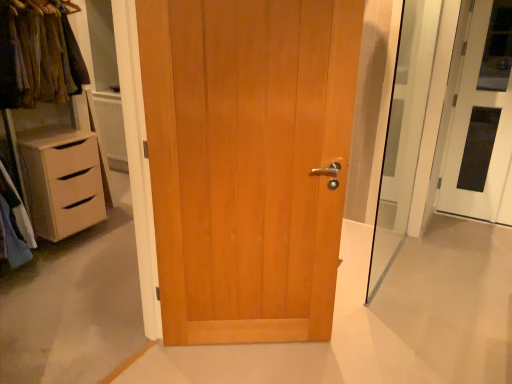
Identify the location of transparent glass screen door at right. (403, 134).

Where is `white glossy door at right, the 2th door positioned from the left`? white glossy door at right, the 2th door positioned from the left is located at coordinates (482, 122).

From the image's perspective, is white glossy door at right, the 2th door positioned from the left, on light brown wood door at center, the 2th door from the back?

Yes, from the image's perspective, white glossy door at right, the 2th door positioned from the left, is on top of light brown wood door at center, the 2th door from the back.

Is white glossy door at right, the 2th door positioned from the left, looking in the opposite direction of light brown wood door at center, the 2th door from the back?

No, white glossy door at right, the 2th door positioned from the left, is not facing away from light brown wood door at center, the 2th door from the back.

In the scene shown: From a real-world perspective, is white glossy door at right, the first door when ordered from back to front, physically below light brown wood door at center, the 1th door in the left-to-right sequence?

No.

Considering the relative sizes of transparent glass screen door at right and white glossy door at right, the first door when ordered from back to front, in the image provided, is transparent glass screen door at right smaller than white glossy door at right, the first door when ordered from back to front,?

No.

From the image's perspective, is transparent glass screen door at right beneath white glossy door at right, the 2th door positioned from the left?

Correct, transparent glass screen door at right appears lower than white glossy door at right, the 2th door positioned from the left, in the image.

Could you tell me if transparent glass screen door at right is facing white glossy door at right, the 2th door positioned from the left?

No, transparent glass screen door at right is not aimed at white glossy door at right, the 2th door positioned from the left.

Which is behind, transparent glass screen door at right or white glossy door at right, the 2th door from the front?

Positioned behind is white glossy door at right, the 2th door from the front.

Is light brown wood door at center, the 2th door from the back, bigger or smaller than transparent glass screen door at right?

Considering their sizes, light brown wood door at center, the 2th door from the back, takes up more space than transparent glass screen door at right.

How many degrees apart are the facing directions of light brown wood door at center, the 1th door in the left-to-right sequence, and transparent glass screen door at right?

There is a 55.9-degree angle between the facing directions of light brown wood door at center, the 1th door in the left-to-right sequence, and transparent glass screen door at right.

Looking at this image, is light brown wood door at center, the 2th door from the back, wider or thinner than transparent glass screen door at right?

Considering their sizes, light brown wood door at center, the 2th door from the back, looks broader than transparent glass screen door at right.

Are light brown wood door at center, the 2th door from the back, and transparent glass screen door at right located far from each other?

light brown wood door at center, the 2th door from the back, is far away from transparent glass screen door at right.

Measure the distance from white glossy door at right, which ranks as the 1th door in right-to-left order, to transparent glass screen door at right.

A distance of 23.56 inches exists between white glossy door at right, which ranks as the 1th door in right-to-left order, and transparent glass screen door at right.

Is white glossy door at right, which ranks as the 1th door in right-to-left order, positioned behind transparent glass screen door at right?

Yes.

Between white glossy door at right, the 2th door positioned from the left, and transparent glass screen door at right, which one has more height?

transparent glass screen door at right is taller.

Does light brown wood door at center, the 2th door from the right, have a greater width compared to white glossy door at right, the first door when ordered from back to front?

Yes, light brown wood door at center, the 2th door from the right, is wider than white glossy door at right, the first door when ordered from back to front.

Which is behind, point (217, 252) or point (498, 164)?

The point (498, 164) is more distant.

Where is `door above the light brown wood door at center, the 2th door from the right (from the image's perspective)`? The height and width of the screenshot is (384, 512). door above the light brown wood door at center, the 2th door from the right (from the image's perspective) is located at coordinates (482, 122).

Is light brown wood door at center, the 1th door in the left-to-right sequence, closer to camera compared to white glossy door at right, the first door when ordered from back to front?

Yes, light brown wood door at center, the 1th door in the left-to-right sequence, is in front of white glossy door at right, the first door when ordered from back to front.

From the picture: Considering the sizes of transparent glass screen door at right and light brown wood door at center, the first door when ordered from front to back, in the image, is transparent glass screen door at right wider or thinner than light brown wood door at center, the first door when ordered from front to back,?

Clearly, transparent glass screen door at right has less width compared to light brown wood door at center, the first door when ordered from front to back.

Which object is positioned more to the left, transparent glass screen door at right or light brown wood door at center, the 2th door from the back?

Positioned to the left is light brown wood door at center, the 2th door from the back.

From a real-world perspective, is transparent glass screen door at right located beneath light brown wood door at center, the 2th door from the back?

No, from a real-world perspective, transparent glass screen door at right is not beneath light brown wood door at center, the 2th door from the back.

I want to click on door above the light brown wood door at center, the 1th door in the left-to-right sequence (from the image's perspective), so click(x=482, y=122).

This screenshot has height=384, width=512. What are the coordinates of `door on the right of transparent glass screen door at right` in the screenshot? It's located at (482, 122).

Considering their positions, is transparent glass screen door at right positioned closer to light brown wood door at center, the 2th door from the back, than white glossy door at right, the first door when ordered from back to front?

transparent glass screen door at right is positioned closer to the anchor light brown wood door at center, the 2th door from the back.

Considering their positions, is light brown wood door at center, the first door when ordered from front to back, positioned closer to white glossy door at right, the 2th door from the front, than transparent glass screen door at right?

transparent glass screen door at right.

Considering their positions, is white glossy door at right, the 2th door from the front, positioned closer to transparent glass screen door at right than light brown wood door at center, the 2th door from the back?

white glossy door at right, the 2th door from the front, is positioned closer to the anchor transparent glass screen door at right.

Which object lies nearer to the anchor point light brown wood door at center, the first door when ordered from front to back, white glossy door at right, the 2th door positioned from the left, or transparent glass screen door at right?

transparent glass screen door at right.

Looking at the image, which one is located closer to white glossy door at right, the first door when ordered from back to front, transparent glass screen door at right or light brown wood door at center, the 2th door from the right?

Among the two, transparent glass screen door at right is located nearer to white glossy door at right, the first door when ordered from back to front.

From the image, which object appears to be nearer to transparent glass screen door at right, light brown wood door at center, the 2th door from the back, or white glossy door at right, the 2th door from the front?

white glossy door at right, the 2th door from the front, lies closer to transparent glass screen door at right than the other object.

Where is `screen door between light brown wood door at center, the 1th door in the left-to-right sequence, and white glossy door at right, the 2th door from the front, from left to right`? This screenshot has height=384, width=512. screen door between light brown wood door at center, the 1th door in the left-to-right sequence, and white glossy door at right, the 2th door from the front, from left to right is located at coordinates click(x=403, y=134).